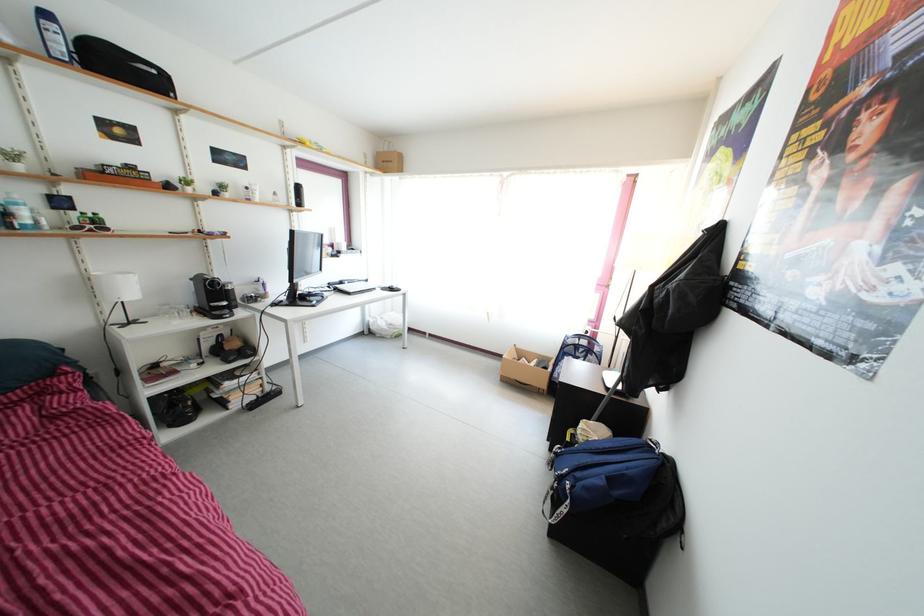
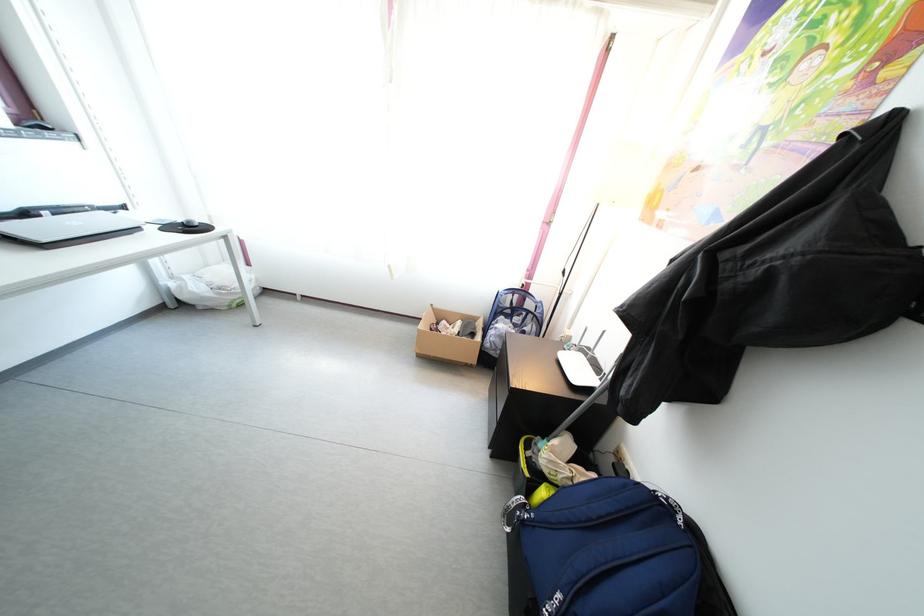
Locate, in the second image, the point that corresponds to point (552, 377) in the first image.

(480, 342)